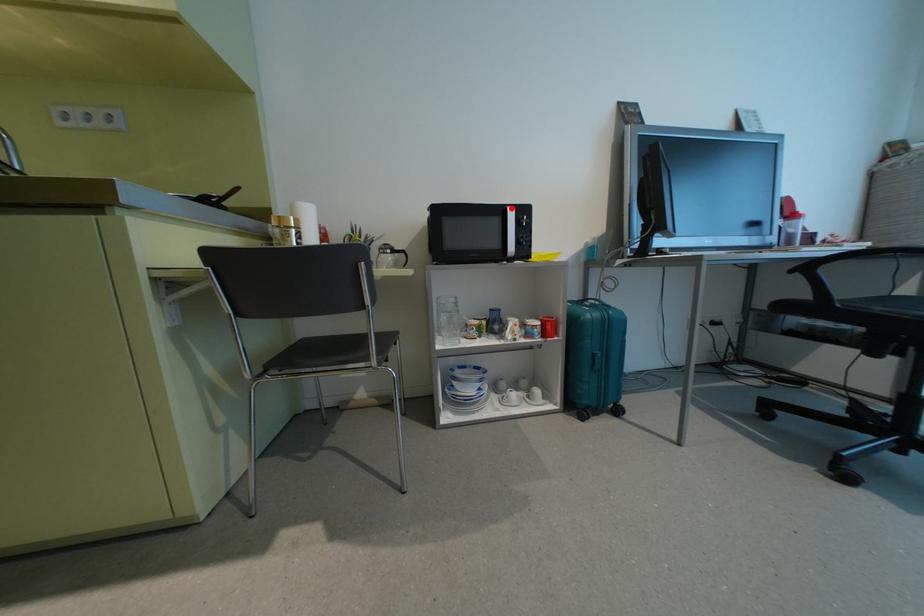
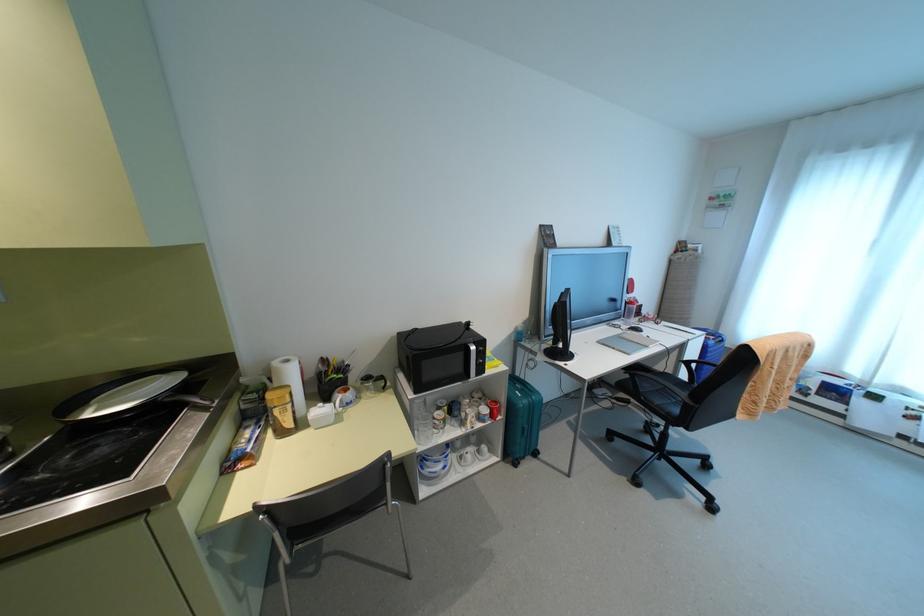
In the second image, find the point that corresponds to the highlighted location in the first image.

(472, 347)